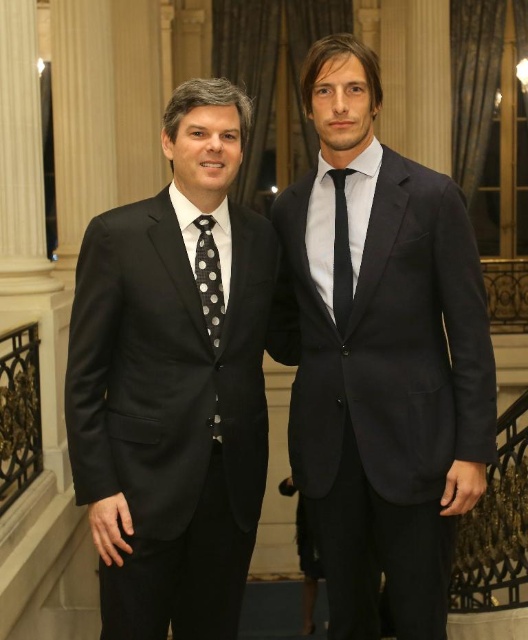
Question: Is matte black suit at left positioned in front of black silk tie at center?

Choices:
 (A) yes
 (B) no

Answer: (A)

Question: Estimate the real-world distances between objects in this image. Which object is farther from the matte black suit at left?

Choices:
 (A) black silk tie at center
 (B) black dotted fabric tie at left

Answer: (A)

Question: Estimate the real-world distances between objects in this image. Which object is farther from the matte black suit at left?

Choices:
 (A) black dotted fabric tie at left
 (B) black silk tie at center
 (C) dark blue suit at center

Answer: (B)

Question: Which point appears closest to the camera in this image?

Choices:
 (A) (220, 323)
 (B) (359, 147)
 (C) (345, 173)

Answer: (A)

Question: Does matte black suit at left have a smaller size compared to black dotted fabric tie at left?

Choices:
 (A) yes
 (B) no

Answer: (B)

Question: Is the position of matte black suit at left less distant than that of black dotted fabric tie at left?

Choices:
 (A) no
 (B) yes

Answer: (B)